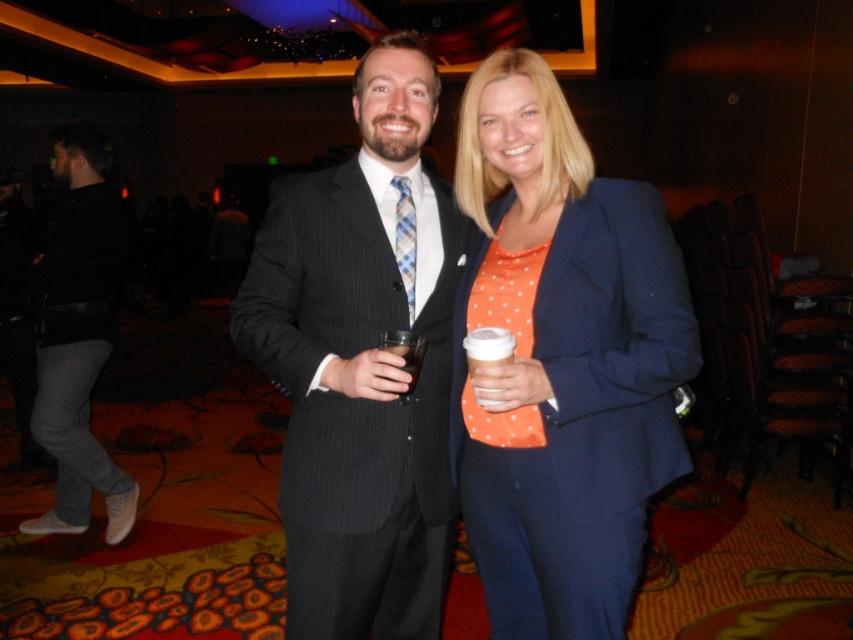
Who is lower down, dark gray jeans at left or white paper cup at center?

Positioned lower is white paper cup at center.

Is dark gray jeans at left to the right of white paper cup at center from the viewer's perspective?

No, dark gray jeans at left is not to the right of white paper cup at center.

Describe the element at coordinates (79, 336) in the screenshot. The image size is (853, 640). I see `dark gray jeans at left` at that location.

The height and width of the screenshot is (640, 853). I want to click on dark gray jeans at left, so tap(79, 336).

Is matte black suit at center taller than matte plastic cup at center?

Yes, matte black suit at center is taller than matte plastic cup at center.

Which is more to the left, matte black suit at center or matte plastic cup at center?

Positioned to the left is matte black suit at center.

Measure the distance between matte black suit at center and camera.

matte black suit at center is 3.90 feet from camera.

I want to click on matte black suit at center, so click(x=363, y=362).

Does blue fabric jacket at center appear under matte black suit at center?

Yes, blue fabric jacket at center is below matte black suit at center.

Identify the location of blue fabric jacket at center. The width and height of the screenshot is (853, 640). (561, 362).